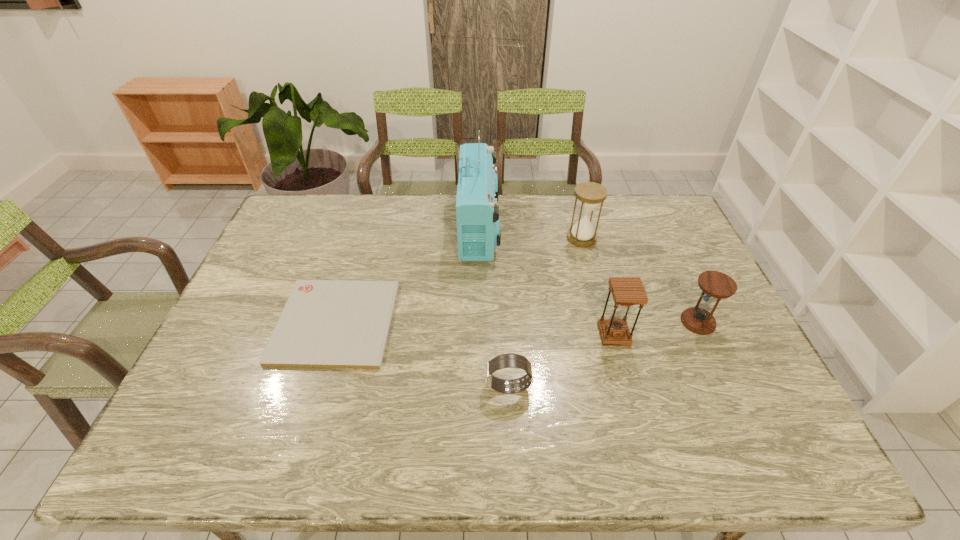
At what (x,y) coordinates should I click in order to perform the action: click on the closest hourglass to the farthest hourglass. Please return your answer as a coordinate pair (x, y). Looking at the image, I should click on (715, 285).

Image resolution: width=960 pixels, height=540 pixels. I want to click on hourglass that is the third closest to the clipboard, so click(715, 285).